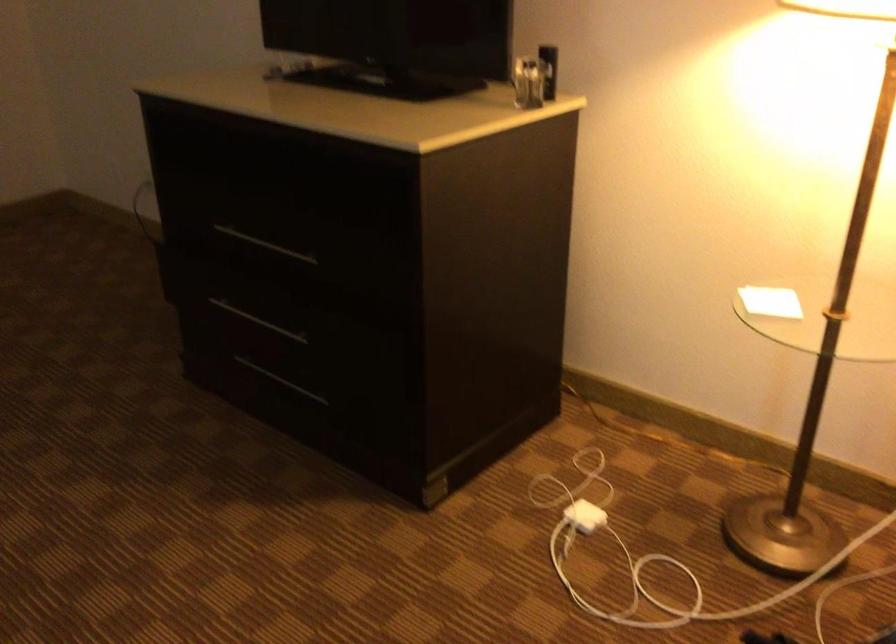
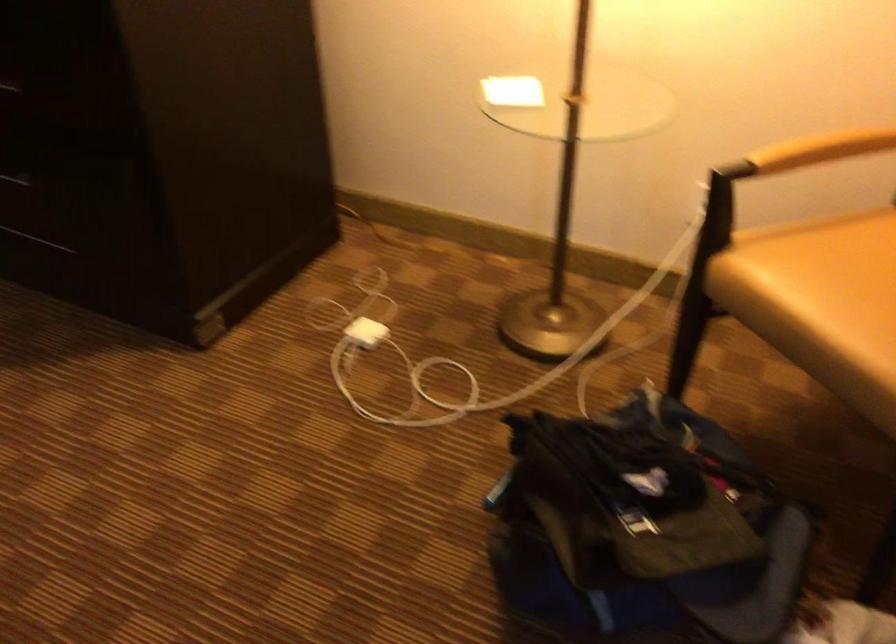
Find the pixel in the second image that matches [767,295] in the first image.

(513, 91)